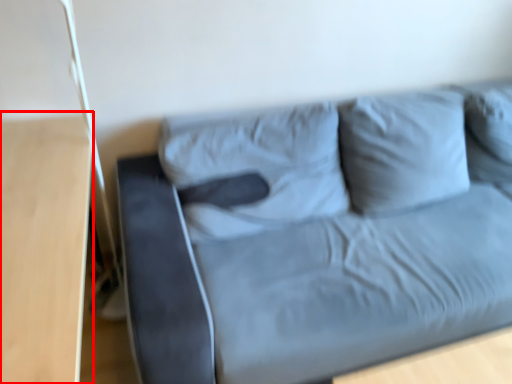
Question: From the image's perspective, what is the correct spatial positioning of table (annotated by the red box) in reference to studio couch?

Choices:
 (A) above
 (B) below

Answer: (B)